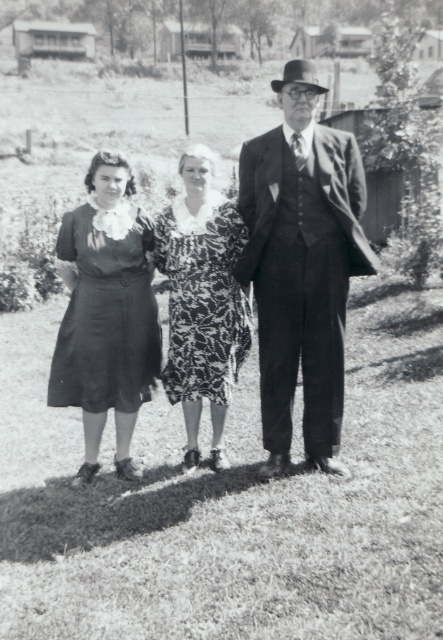
Identify the location of matte black dresses at center. The image size is (443, 640). (107, 312).

Between matte black dresses at center and matte black dress at left, which one is positioned lower?

matte black dresses at center is lower down.

Does point (139, 396) come closer to viewer compared to point (104, 273)?

No, it is behind (104, 273).

At what (x,y) coordinates should I click in order to perform the action: click on matte black dresses at center. Please return your answer as a coordinate pair (x, y). This screenshot has width=443, height=640. Looking at the image, I should click on (107, 312).

Can you confirm if matte black dresses at center is shorter than printed fabric dress at center?

Incorrect, matte black dresses at center's height does not fall short of printed fabric dress at center's.

Between matte black dresses at center and printed fabric dress at center, which one has more height?

matte black dresses at center

Describe the element at coordinates (107, 312) in the screenshot. I see `matte black dresses at center` at that location.

Find the location of a particular element. This screenshot has width=443, height=640. matte black dresses at center is located at coordinates (107, 312).

Between point (330, 445) and point (81, 323), which one is positioned behind?

Positioned behind is point (330, 445).

Is matte black dress at center positioned at the back of matte black dress at left?

Yes, it is behind matte black dress at left.

At what (x,y) coordinates should I click in order to perform the action: click on matte black dress at center. Please return your answer as a coordinate pair (x, y). Image resolution: width=443 pixels, height=640 pixels. Looking at the image, I should click on (302, 266).